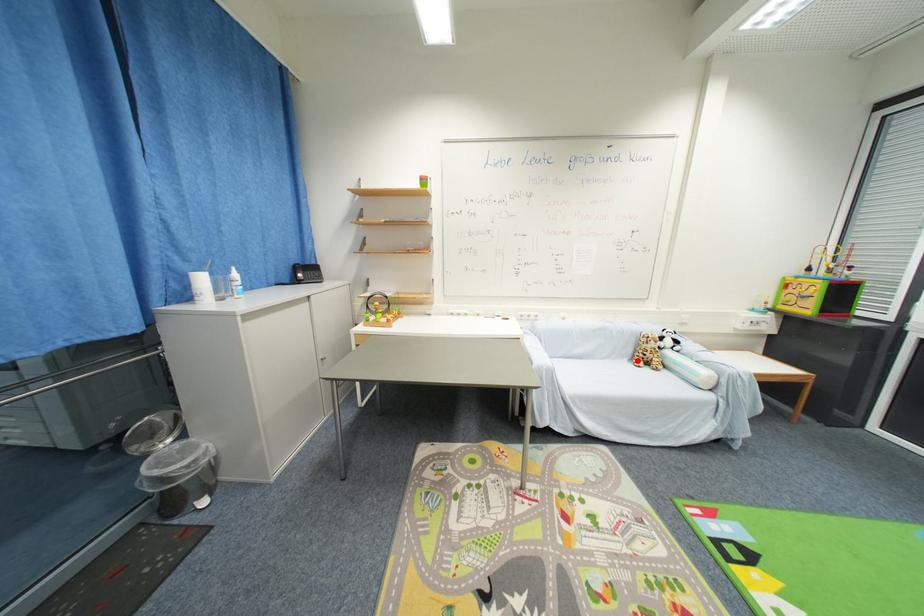
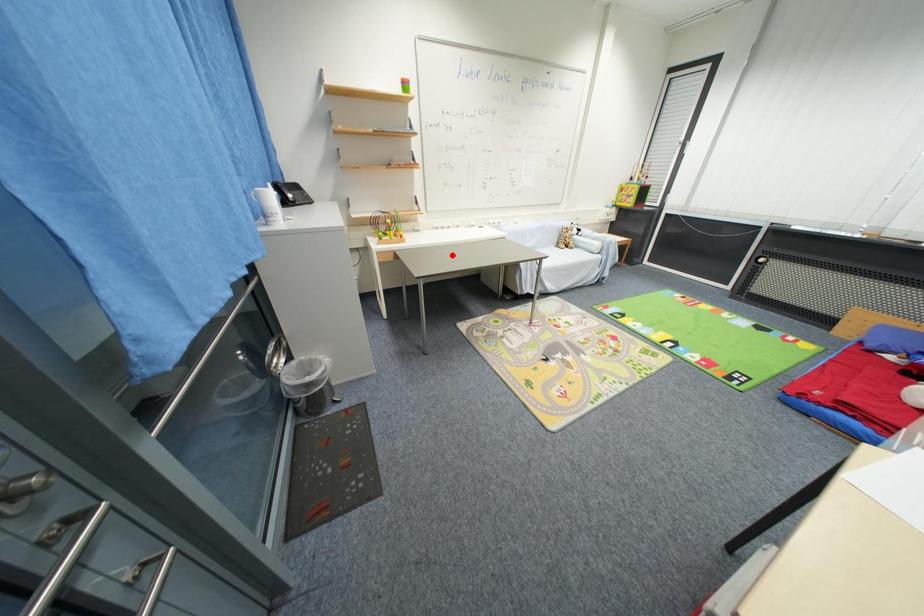
I am providing you with two images of the same scene from different viewpoints. A red point is marked on the first image and another point is marked on the second image. Are the points marked in image1 and image2 representing the same 3D position?

No